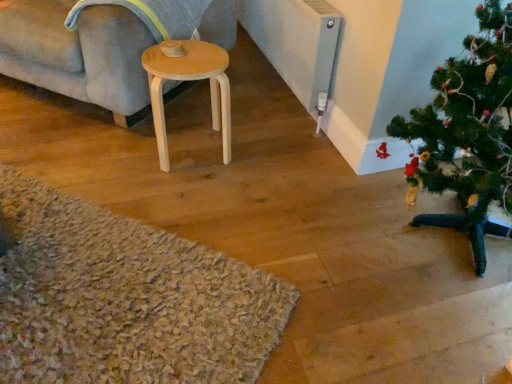
Question: Is light wood stool at center wider or thinner than light gray fabric couch at upper left?

Choices:
 (A) wide
 (B) thin

Answer: (B)

Question: From their relative heights in the image, would you say light wood stool at center is taller or shorter than light gray fabric couch at upper left?

Choices:
 (A) tall
 (B) short

Answer: (B)

Question: Estimate the real-world distances between objects in this image. Which object is farther from the light gray fabric couch at upper left?

Choices:
 (A) green matte christmas tree at lower right
 (B) light wood stool at center
 (C) textured gray radiator at center right

Answer: (A)

Question: Estimate the real-world distances between objects in this image. Which object is closer to the light wood stool at center?

Choices:
 (A) green matte christmas tree at lower right
 (B) textured gray radiator at center right
 (C) light gray fabric couch at upper left

Answer: (C)